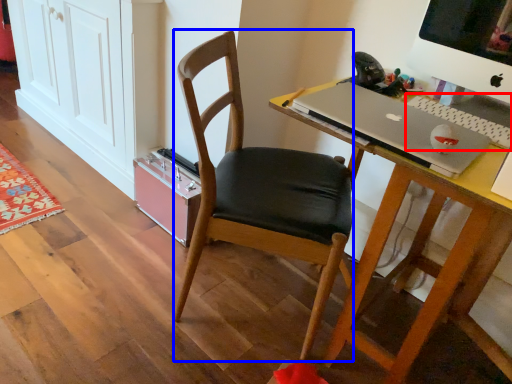
Question: Which object appears farthest to the camera in this image, laptop keyboard (highlighted by a red box) or chair (highlighted by a blue box)?

Choices:
 (A) laptop keyboard
 (B) chair

Answer: (A)